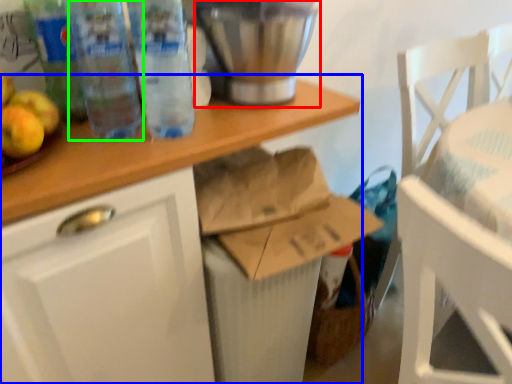
Question: Based on their relative distances, which object is farther from appliance (highlighted by a red box)? Choose from desk (highlighted by a blue box) and bottle (highlighted by a green box).

Choices:
 (A) desk
 (B) bottle

Answer: (B)